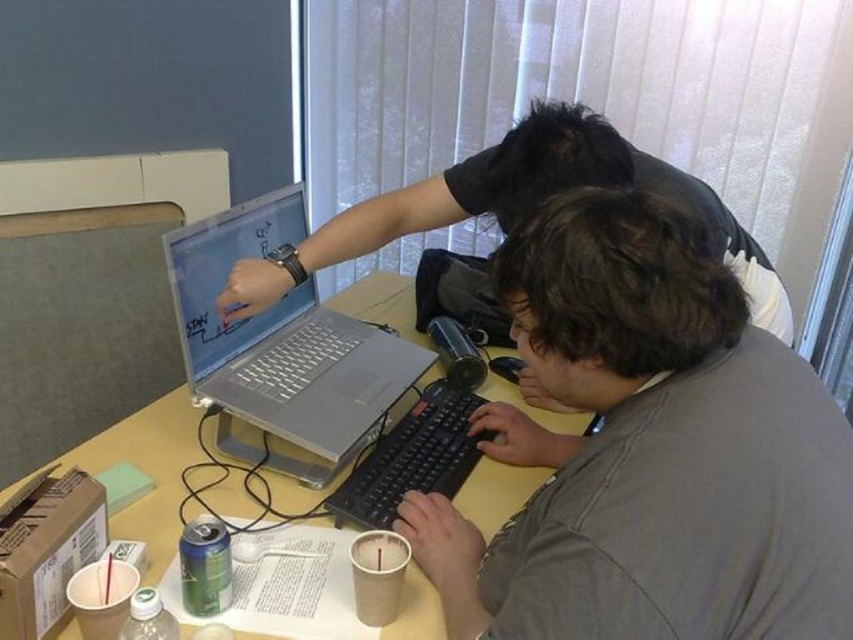
Between silver metallic laptop at center-left and black plastic keyboard at center, which one appears on the right side from the viewer's perspective?

black plastic keyboard at center is more to the right.

Can you confirm if silver metallic laptop at center-left is shorter than black plastic keyboard at center?

Incorrect, silver metallic laptop at center-left's height does not fall short of black plastic keyboard at center's.

Image resolution: width=853 pixels, height=640 pixels. What do you see at coordinates (227, 275) in the screenshot? I see `silver metallic laptop at center-left` at bounding box center [227, 275].

Locate an element on the screen. This screenshot has width=853, height=640. silver metallic laptop at center-left is located at coordinates (227, 275).

Between matte black laptop at upper center and silver metallic laptop at center, which one is positioned higher?

matte black laptop at upper center is above.

Is point (318, 257) more distant than point (258, 316)?

No, (318, 257) is closer to viewer.

At what (x,y) coordinates should I click in order to perform the action: click on matte black laptop at upper center. Please return your answer as a coordinate pair (x, y). The image size is (853, 640). Looking at the image, I should click on (514, 209).

Is point (445, 268) positioned after point (166, 524)?

That is True.

Which is more to the right, matte black laptop at upper center or matte silver laptop at center?

matte black laptop at upper center

Identify the location of matte black laptop at upper center. (514, 209).